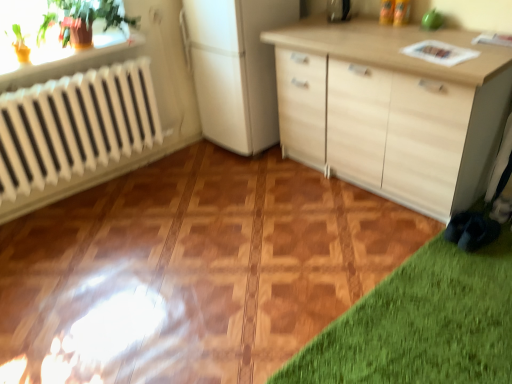
Question: From a real-world perspective, is green glossy plant at upper left positioned above or below metallic silver toaster at upper center?

Choices:
 (A) above
 (B) below

Answer: (A)

Question: From their relative heights in the image, would you say green glossy plant at upper left is taller or shorter than metallic silver toaster at upper center?

Choices:
 (A) short
 (B) tall

Answer: (B)

Question: Is green glossy plant at upper left wider or thinner than metallic silver toaster at upper center?

Choices:
 (A) thin
 (B) wide

Answer: (B)

Question: Is metallic silver toaster at upper center to the left or to the right of green glossy plant at upper left in the image?

Choices:
 (A) left
 (B) right

Answer: (B)

Question: Considering the positions of metallic silver toaster at upper center and green glossy plant at upper left in the image, is metallic silver toaster at upper center taller or shorter than green glossy plant at upper left?

Choices:
 (A) tall
 (B) short

Answer: (B)

Question: Looking at their shapes, would you say metallic silver toaster at upper center is wider or thinner than green glossy plant at upper left?

Choices:
 (A) thin
 (B) wide

Answer: (A)

Question: Is point (331, 11) positioned closer to the camera than point (70, 19)?

Choices:
 (A) farther
 (B) closer

Answer: (A)